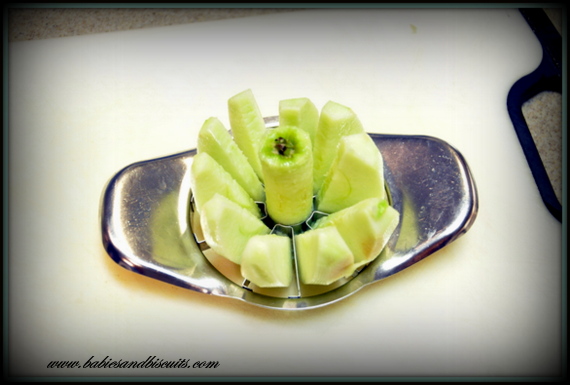
Identify the location of white cutting board. This screenshot has height=385, width=570. (507, 55).